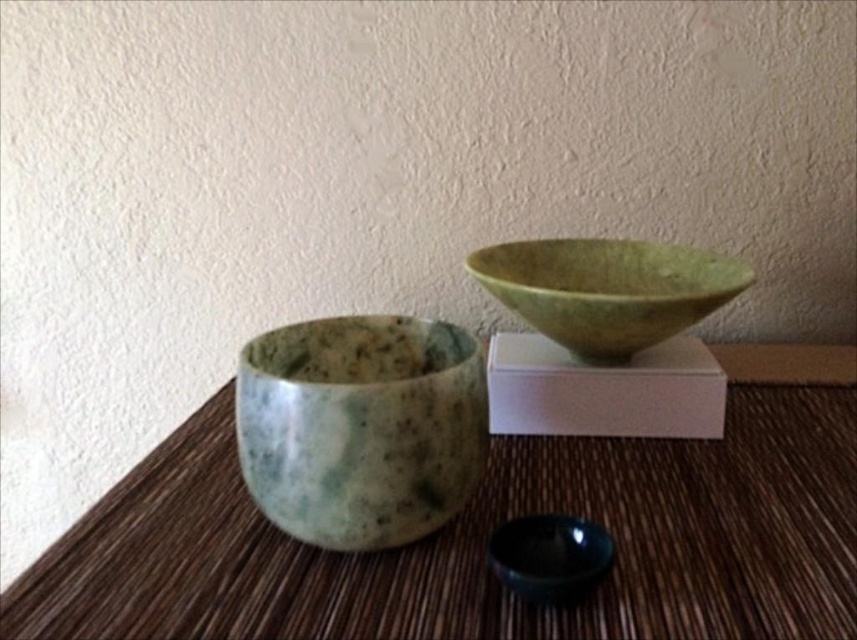
Is point (453, 337) more distant than point (598, 328)?

No.

What do you see at coordinates (361, 428) in the screenshot? I see `speckled stone bowl at center` at bounding box center [361, 428].

This screenshot has width=857, height=640. Identify the location of speckled stone bowl at center. (361, 428).

The width and height of the screenshot is (857, 640). Find the location of `speckled stone bowl at center`. speckled stone bowl at center is located at coordinates (361, 428).

Can you confirm if brown woven mat at center is wider than green marble bowl at upper center?

Yes, brown woven mat at center is wider than green marble bowl at upper center.

At what (x,y) coordinates should I click in order to perform the action: click on brown woven mat at center. Please return your answer as a coordinate pair (x, y). The height and width of the screenshot is (640, 857). Looking at the image, I should click on (488, 536).

Locate an element on the screen. This screenshot has width=857, height=640. brown woven mat at center is located at coordinates click(488, 536).

Is green marble bowl at upper center below black glossy bowl at lower center?

Incorrect, green marble bowl at upper center is not positioned below black glossy bowl at lower center.

Looking at this image, is green marble bowl at upper center bigger than black glossy bowl at lower center?

Indeed, green marble bowl at upper center has a larger size compared to black glossy bowl at lower center.

Between point (655, 324) and point (592, 552), which one is positioned in front?

Point (592, 552) is more forward.

Find the location of a particular element. Image resolution: width=857 pixels, height=640 pixels. green marble bowl at upper center is located at coordinates (607, 291).